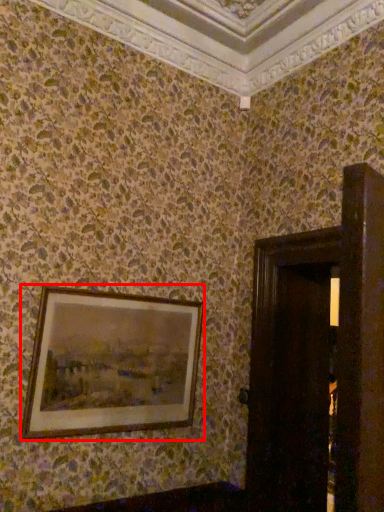
Question: Where is picture frame (annotated by the red box) located in relation to door in the image?

Choices:
 (A) right
 (B) left

Answer: (B)